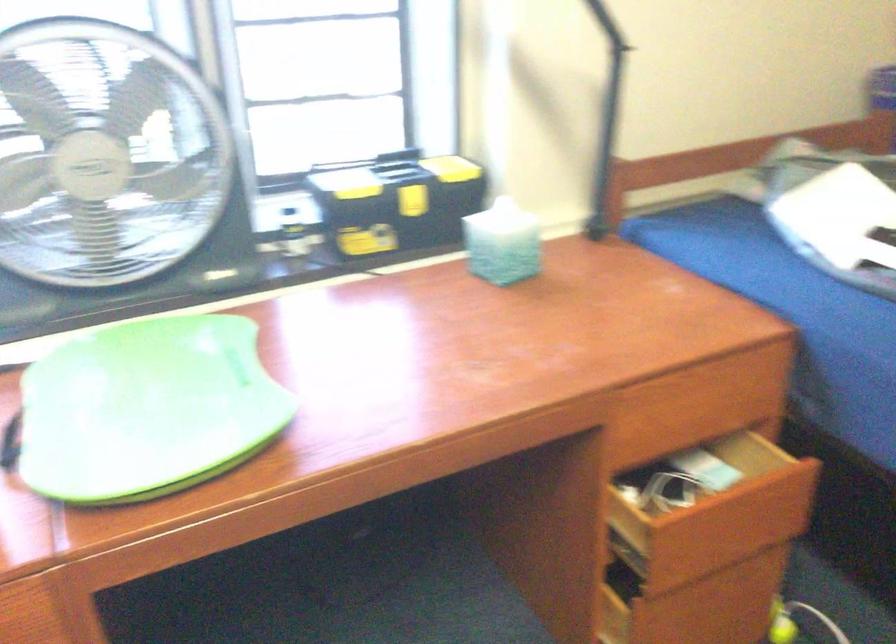
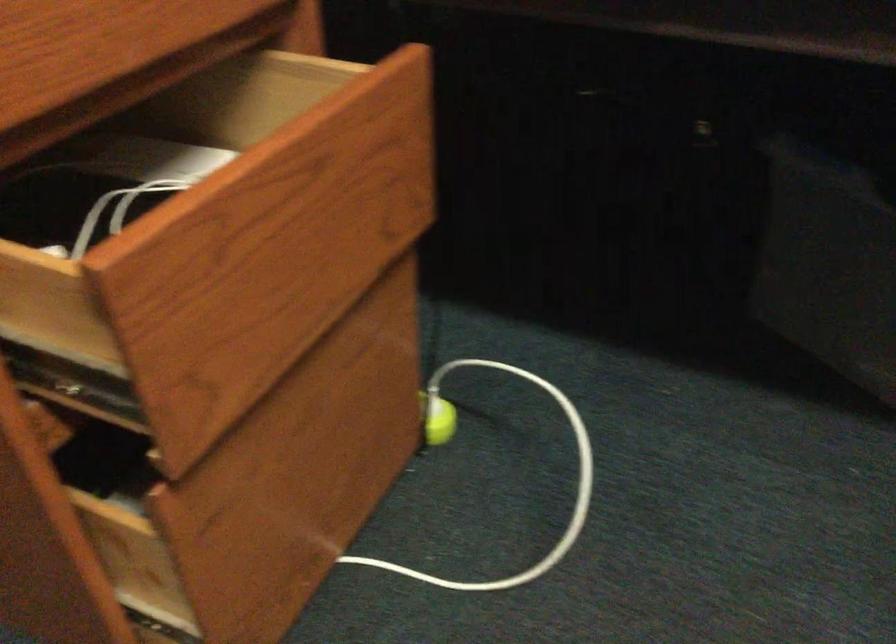
Question: The camera is either moving clockwise (left) or counter-clockwise (right) around the object. The first image is from the beginning of the video and the second image is from the end. Is the camera moving left or right when shooting the video?

Choices:
 (A) Left
 (B) Right

Answer: (A)